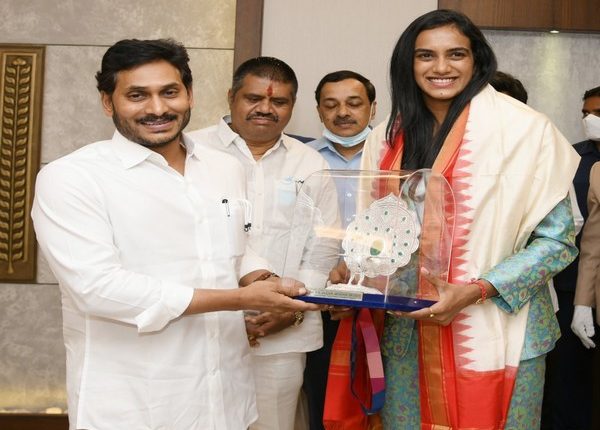
The image size is (600, 430). Identify the location of light. (557, 32).